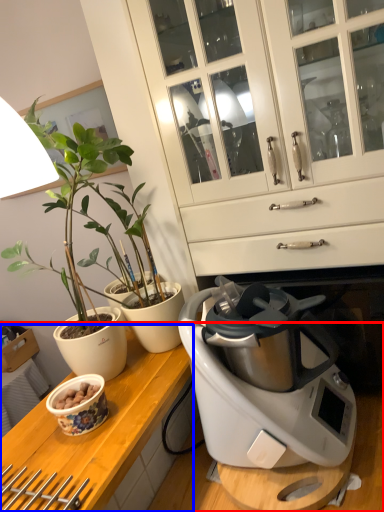
Question: Which object appears closest to the camera in this image, countertop (highlighted by a red box) or counter top (highlighted by a blue box)?

Choices:
 (A) countertop
 (B) counter top

Answer: (A)